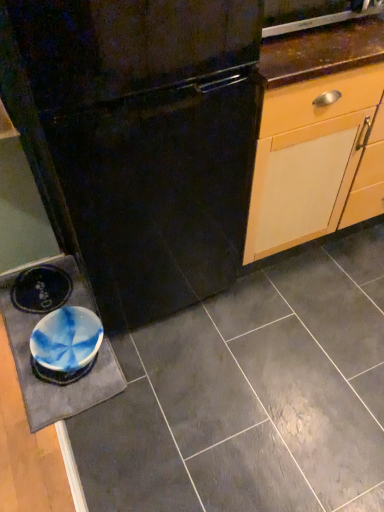
This screenshot has height=512, width=384. I want to click on free space in front of black matte refrigerator at center, so click(x=170, y=406).